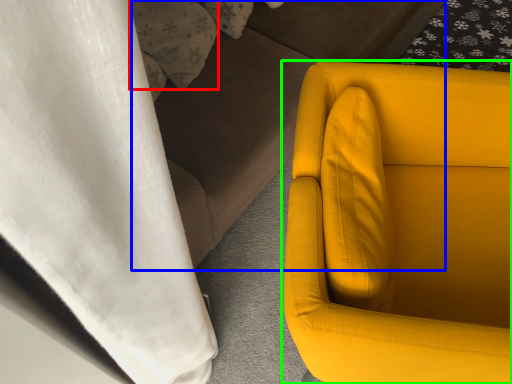
Question: Which object is positioned closest to pillow (highlighted by a red box)? Select from couch (highlighted by a blue box) and chair (highlighted by a green box).

Choices:
 (A) couch
 (B) chair

Answer: (A)